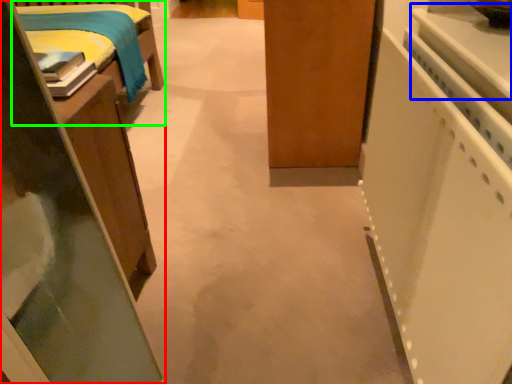
Question: Which object is the closest to the furniture (highlighted by a red box)? Choose among these: counter top (highlighted by a blue box) or furniture (highlighted by a green box).

Choices:
 (A) counter top
 (B) furniture

Answer: (A)